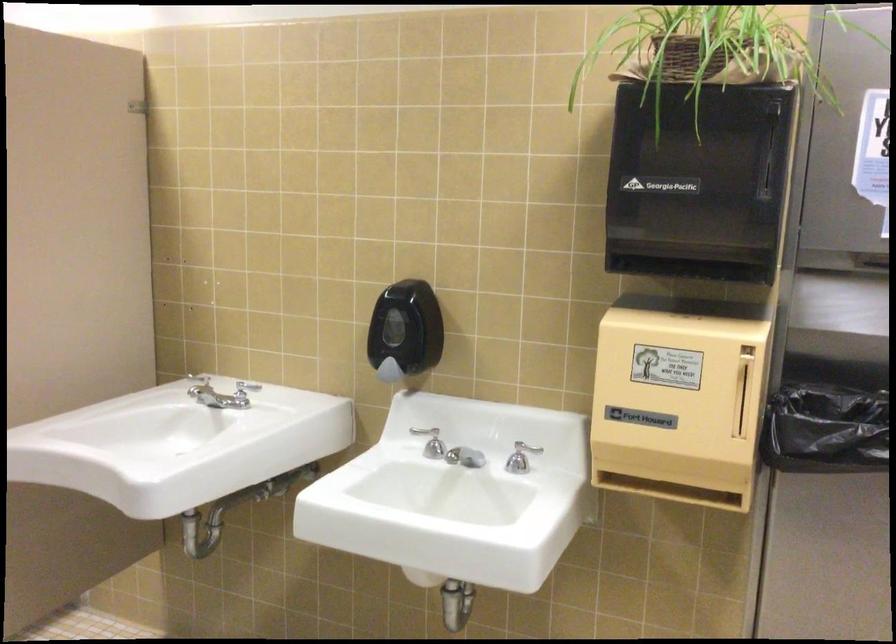
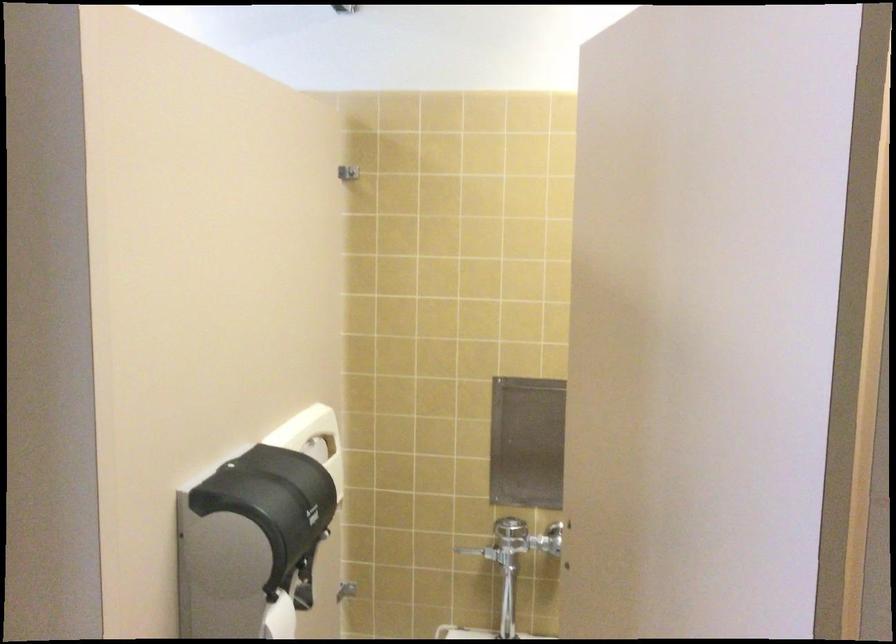
Question: What movement of the cameraman would produce the second image?

Choices:
 (A) Left
 (B) Right
 (C) Forward
 (D) Backward

Answer: (A)